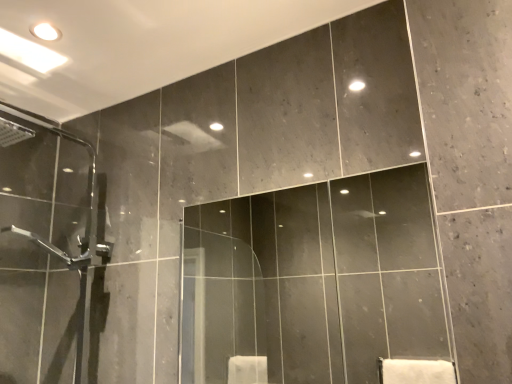
Question: Does point (84, 180) appear closer or farther from the camera than point (382, 256)?

Choices:
 (A) closer
 (B) farther

Answer: (A)

Question: Is clear glass shower door at left taller or shorter than matte glass mirror at center?

Choices:
 (A) short
 (B) tall

Answer: (B)

Question: Considering their positions, is clear glass shower door at left located in front of or behind matte glass mirror at center?

Choices:
 (A) front
 (B) behind

Answer: (B)

Question: Looking at their shapes, would you say matte glass mirror at center is wider or thinner than clear glass shower door at left?

Choices:
 (A) wide
 (B) thin

Answer: (B)

Question: Is matte glass mirror at center inside the boundaries of clear glass shower door at left, or outside?

Choices:
 (A) outside
 (B) inside

Answer: (A)

Question: Is point (202, 276) closer or farther from the camera than point (12, 210)?

Choices:
 (A) farther
 (B) closer

Answer: (A)

Question: From a real-world perspective, is matte glass mirror at center above or below clear glass shower door at left?

Choices:
 (A) above
 (B) below

Answer: (B)